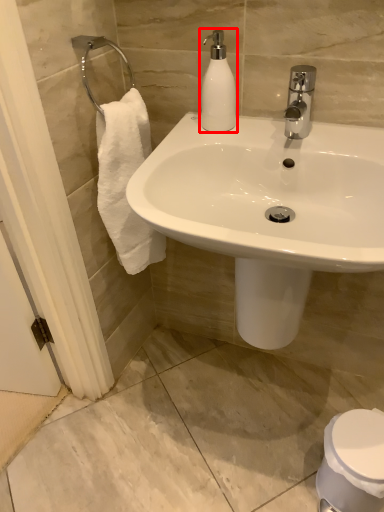
Question: From the image's perspective, where is soap dispenser (annotated by the red box) located relative to toilet?

Choices:
 (A) below
 (B) above

Answer: (B)